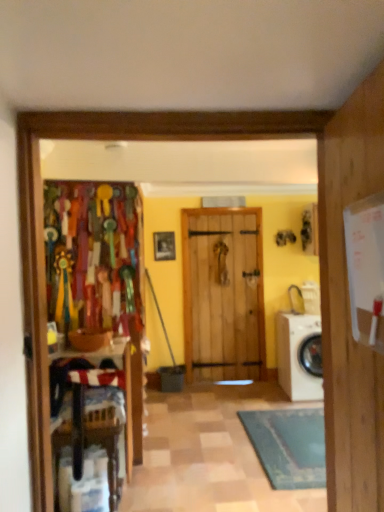
Question: In terms of width, does white glossy washing machine at lower right look wider or thinner when compared to wooden frame at center?

Choices:
 (A) wide
 (B) thin

Answer: (A)

Question: Is white glossy washing machine at lower right taller or shorter than wooden frame at center?

Choices:
 (A) tall
 (B) short

Answer: (A)

Question: Which object is positioned closest to the wooden chair at left?

Choices:
 (A) white glossy washing machine at lower right
 (B) wooden frame at center

Answer: (A)

Question: Which object is positioned closest to the white glossy washing machine at lower right?

Choices:
 (A) wooden chair at left
 (B) wooden frame at center

Answer: (B)